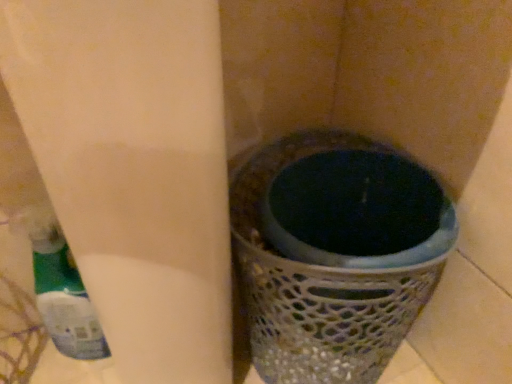
I want to click on metallic mesh waste container at lower right, so click(319, 287).

What is the approximate height of metallic mesh waste container at lower right?

metallic mesh waste container at lower right is 12.58 inches tall.

Describe the element at coordinates (319, 287) in the screenshot. This screenshot has width=512, height=384. I see `metallic mesh waste container at lower right` at that location.

The height and width of the screenshot is (384, 512). In order to click on metallic mesh waste container at lower right in this screenshot , I will do `click(319, 287)`.